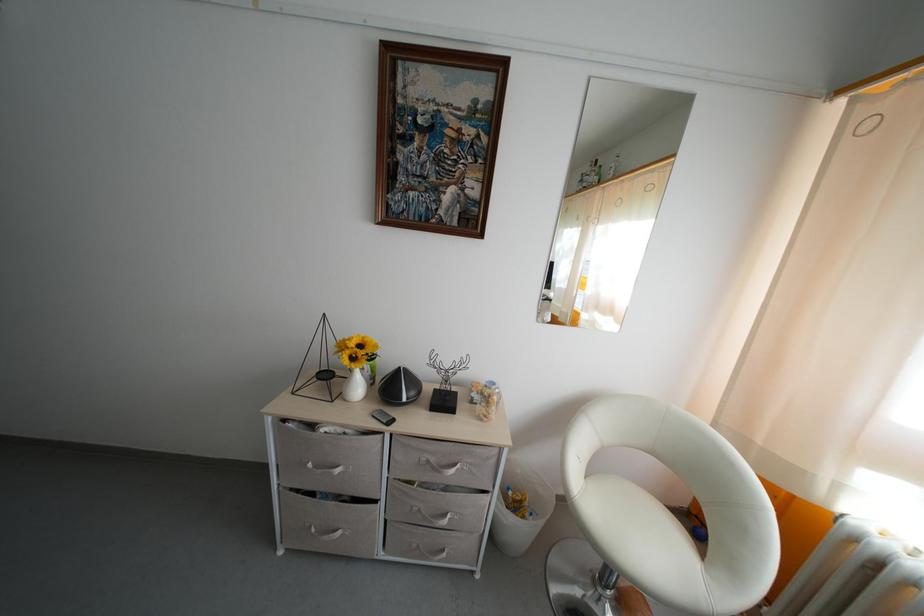
Where is `small glass jar`? Image resolution: width=924 pixels, height=616 pixels. small glass jar is located at coordinates (485, 400).